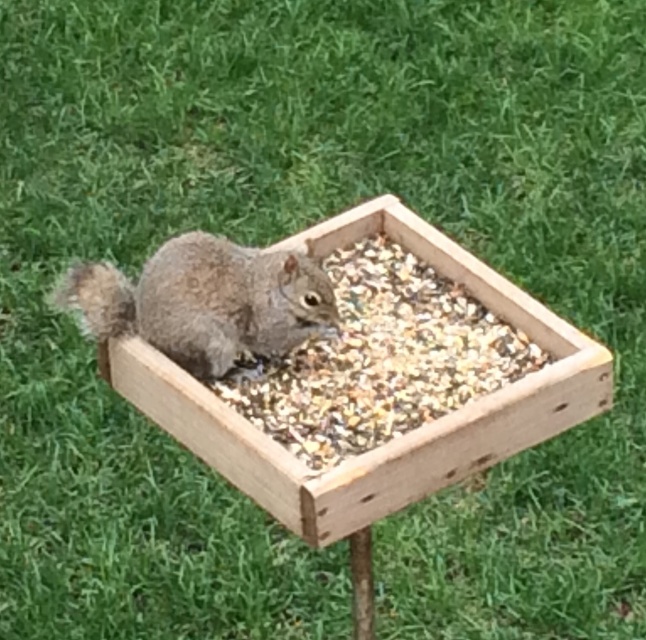
Question: Which of the following is the farthest from the observer?

Choices:
 (A) brown textured wood at center
 (B) gray furry squirrel at center

Answer: (B)

Question: Where is brown textured wood at center located in relation to gray furry squirrel at center in the image?

Choices:
 (A) above
 (B) below

Answer: (B)

Question: Among these points, which one is farthest from the camera?

Choices:
 (A) (269, 301)
 (B) (328, 385)

Answer: (A)

Question: Which object is closer to the camera taking this photo?

Choices:
 (A) brown textured wood at center
 (B) gray furry squirrel at center

Answer: (A)

Question: Can you confirm if brown textured wood at center is positioned below gray furry squirrel at center?

Choices:
 (A) no
 (B) yes

Answer: (B)

Question: Is brown textured wood at center closer to the viewer compared to gray furry squirrel at center?

Choices:
 (A) yes
 (B) no

Answer: (A)